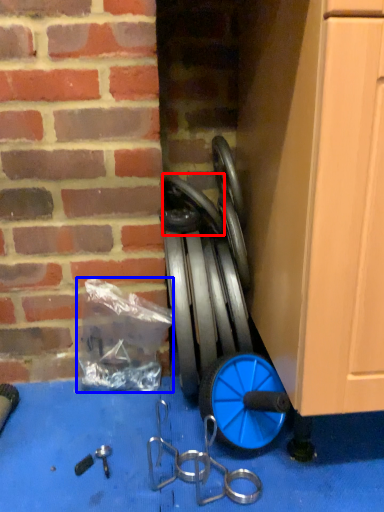
Question: Which point is further to the camera, wheel (highlighted by a red box) or garbage (highlighted by a blue box)?

Choices:
 (A) wheel
 (B) garbage

Answer: (B)